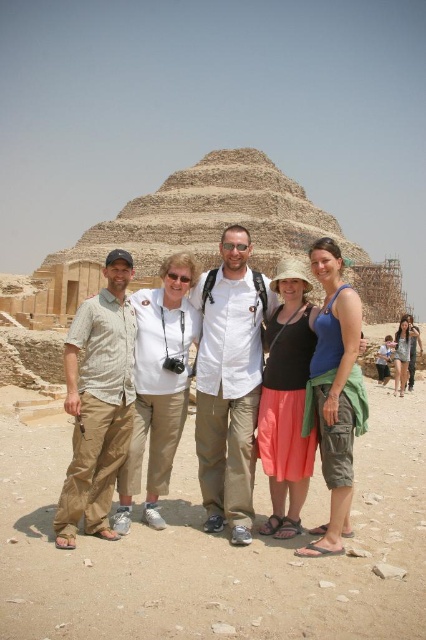
Based on the photo, you are a photographer planning to take a group photo of the five individuals in front of the Step Pyramid of Djoser at Saqqara, Egypt. You notice the blue cotton tank top at center and the matte khaki pants at center. Which clothing item is more likely to show sweat stains during the photo shoot?

The blue cotton tank top at center is thinner than the matte khaki pants at center, so it is more likely to show sweat stains during the photo shoot.

You are a photographer trying to capture a closeup of the blue cotton tank top at center and the matte khaki pants at center. Since the camera can only focus on one object at a time, which one should you choose to ensure the smaller object is in focus?

The blue cotton tank top at center has a smaller size compared to matte khaki pants at center, so you should focus on the blue cotton tank top at center to ensure the smaller object is in focus.